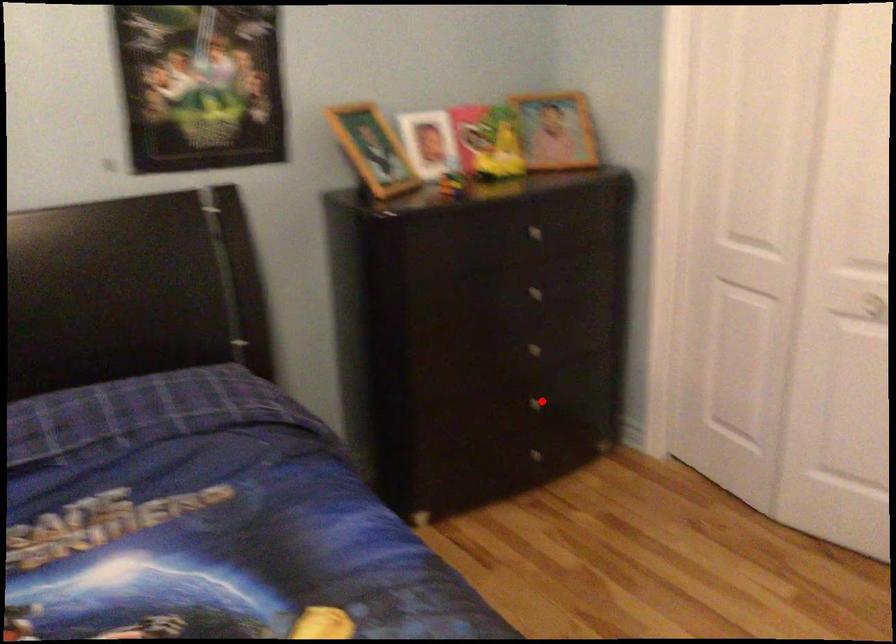
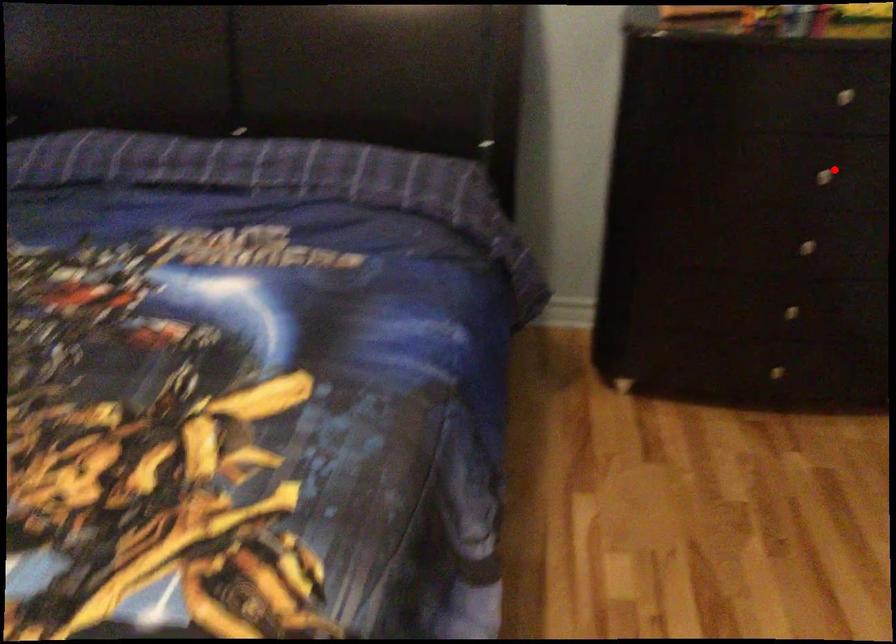
I am providing you with two images of the same scene from different viewpoints. A red point is marked on the first image and another point is marked on the second image. Do the highlighted points in image1 and image2 indicate the same real-world spot?

No